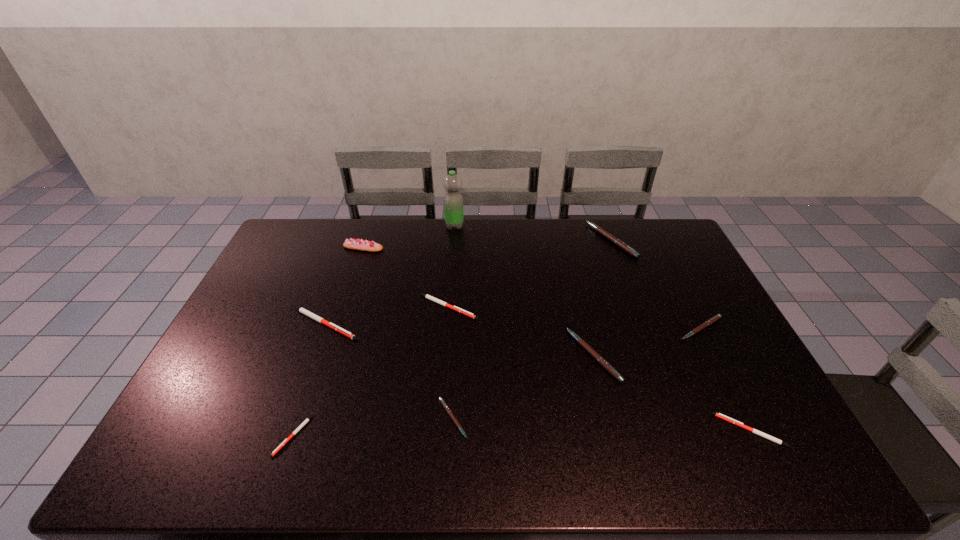
The width and height of the screenshot is (960, 540). Identify the location of the nearest pink pen. (447, 409).

This screenshot has width=960, height=540. Find the location of `the leftmost pink pen`. the leftmost pink pen is located at coordinates (447, 409).

This screenshot has width=960, height=540. In order to click on the third biggest white pen in this screenshot , I will do `click(728, 419)`.

At what (x,y) coordinates should I click in order to perform the action: click on the shortest pen. Please return your answer as a coordinate pair (x, y). The height and width of the screenshot is (540, 960). Looking at the image, I should click on (286, 440).

The image size is (960, 540). What are the coordinates of `the shortest object` in the screenshot? It's located at (286, 440).

This screenshot has height=540, width=960. I want to click on free spot located 0.390m on the front of the water bottle, so click(x=448, y=300).

Locate an element on the screen. Image resolution: width=960 pixels, height=540 pixels. free space located 0.150m on the front of the eclair is located at coordinates (352, 280).

Identify the location of free location located at the nib of the eighth shortest object. (551, 240).

Locate an element on the screen. free space located at the nib of the eighth shortest object is located at coordinates (493, 240).

Where is `blank space located at the nib of the eighth shortest object`? The image size is (960, 540). blank space located at the nib of the eighth shortest object is located at coordinates (501, 240).